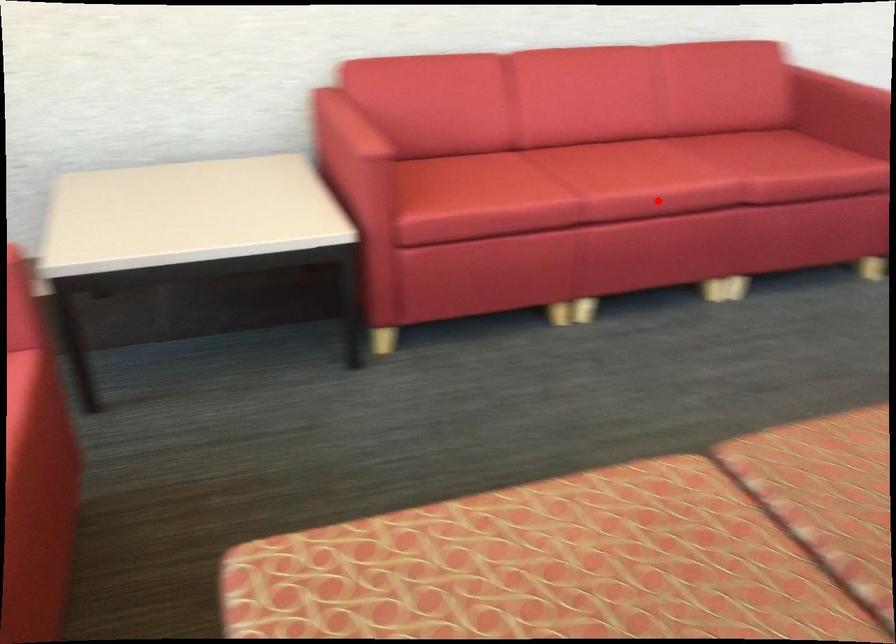
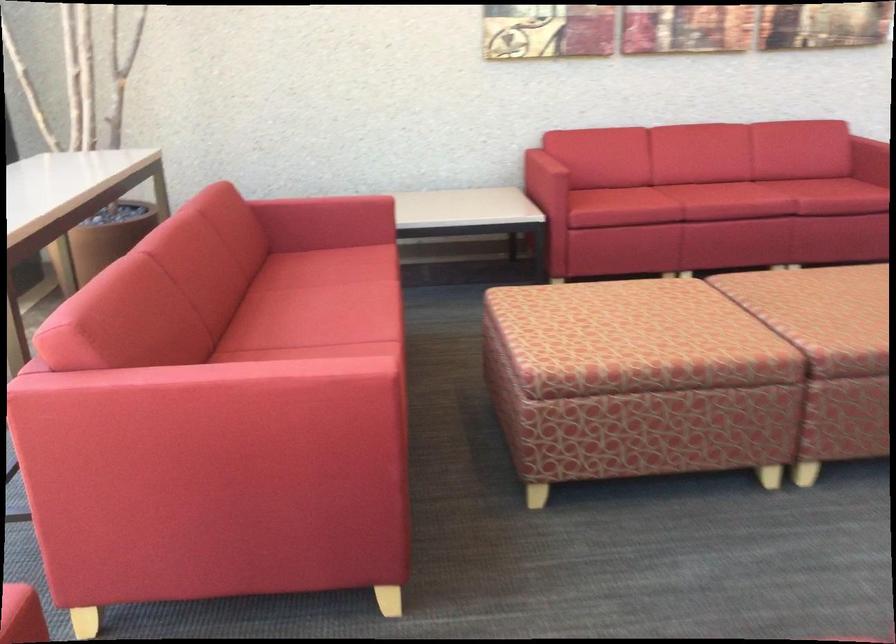
The point at the highlighted location is marked in the first image. Where is the corresponding point in the second image?

(725, 201)